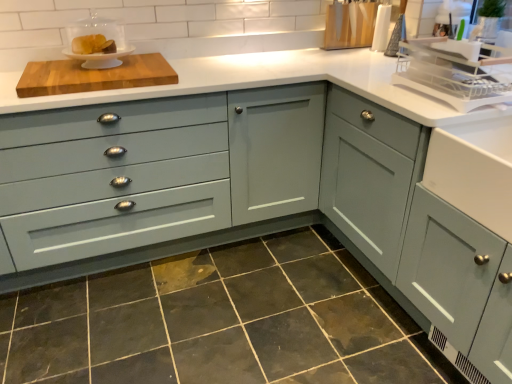
The image size is (512, 384). I want to click on free space in front of wooden knife block at upper right, which is the third appliance in front-to-back order, so click(x=347, y=58).